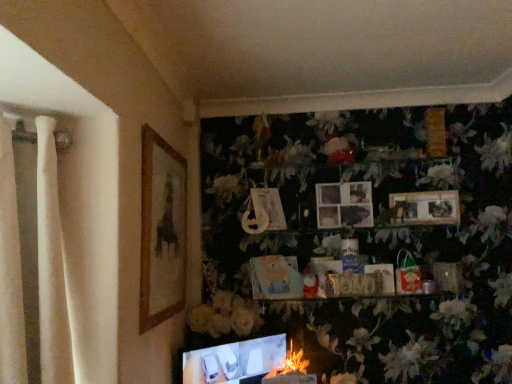
Question: Does fluffy white flower at lower center, the first flower in the right-to-left sequence, have a lesser height compared to matte plastic picture frame at center, the 2th picture frame viewed from the left?

Choices:
 (A) yes
 (B) no

Answer: (A)

Question: Does fluffy white flower at lower center, which ranks as the 1th flower in bottom-to-top order, have a greater width compared to matte plastic picture frame at center, the 2th picture frame viewed from the left?

Choices:
 (A) yes
 (B) no

Answer: (B)

Question: Is fluffy white flower at lower center, the first flower in the right-to-left sequence, located outside matte plastic picture frame at center, the fourth picture frame in the right-to-left sequence?

Choices:
 (A) no
 (B) yes

Answer: (B)

Question: From a real-world perspective, is fluffy white flower at lower center, acting as the 2th flower starting from the left, located higher than matte plastic picture frame at center, the 2th picture frame viewed from the left?

Choices:
 (A) no
 (B) yes

Answer: (A)

Question: Is there a large distance between fluffy white flower at lower center, which is the 2th flower from top to bottom, and matte plastic picture frame at center, the 2th picture frame viewed from the left?

Choices:
 (A) no
 (B) yes

Answer: (A)

Question: Can you confirm if fluffy white flower at lower center, which ranks as the 1th flower in bottom-to-top order, is positioned to the right of matte plastic picture frame at center, the 2th picture frame viewed from the left?

Choices:
 (A) no
 (B) yes

Answer: (B)

Question: Can you confirm if white matte flower at center, positioned as the first flower in left-to-right order, is bigger than matte cardboard picture frame at center, marked as the third picture frame in a left-to-right arrangement?

Choices:
 (A) yes
 (B) no

Answer: (A)

Question: Would you say white matte flower at center, positioned as the first flower in left-to-right order, is a long distance from matte cardboard picture frame at center, marked as the third picture frame in a left-to-right arrangement?

Choices:
 (A) no
 (B) yes

Answer: (A)

Question: Is white matte flower at center, which ranks as the 2th flower in bottom-to-top order, to the right of matte cardboard picture frame at center, marked as the third picture frame in a left-to-right arrangement, from the viewer's perspective?

Choices:
 (A) yes
 (B) no

Answer: (B)

Question: Can you confirm if white matte flower at center, acting as the 1th flower starting from the top, is positioned to the left of matte cardboard picture frame at center, marked as the third picture frame in a left-to-right arrangement?

Choices:
 (A) yes
 (B) no

Answer: (A)

Question: From a real-world perspective, is white matte flower at center, which ranks as the 2th flower in bottom-to-top order, physically below matte cardboard picture frame at center, arranged as the third picture frame when viewed from the right?

Choices:
 (A) yes
 (B) no

Answer: (A)

Question: Is white matte flower at center, positioned as the first flower in left-to-right order, positioned with its back to matte cardboard picture frame at center, marked as the third picture frame in a left-to-right arrangement?

Choices:
 (A) yes
 (B) no

Answer: (B)

Question: Can you confirm if white matte flower at center, which ranks as the 2th flower in bottom-to-top order, is positioned to the right of wooden picture frame at left, the fifth picture frame positioned from the right?

Choices:
 (A) yes
 (B) no

Answer: (A)